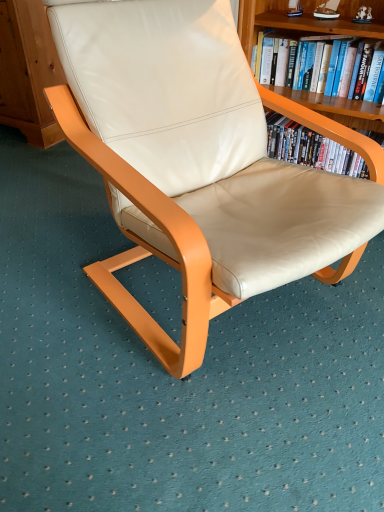
Question: Considering the positions of hardcover book at upper right and wooden bookshelf at upper right in the image, is hardcover book at upper right taller or shorter than wooden bookshelf at upper right?

Choices:
 (A) short
 (B) tall

Answer: (A)

Question: In terms of size, does hardcover book at upper right appear bigger or smaller than wooden bookshelf at upper right?

Choices:
 (A) small
 (B) big

Answer: (A)

Question: Based on their relative distances, which object is nearer to the beige leather chair at center?

Choices:
 (A) wooden bookshelf at upper right
 (B) hardcover book at upper right

Answer: (A)

Question: Which object is positioned farthest from the beige leather chair at center?

Choices:
 (A) hardcover book at upper right
 (B) wooden bookshelf at upper right

Answer: (A)